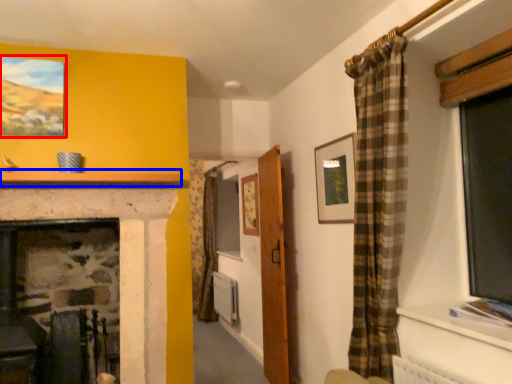
Question: Which point is closer to the camera, picture frame (highlighted by a red box) or mantle (highlighted by a blue box)?

Choices:
 (A) picture frame
 (B) mantle

Answer: (B)